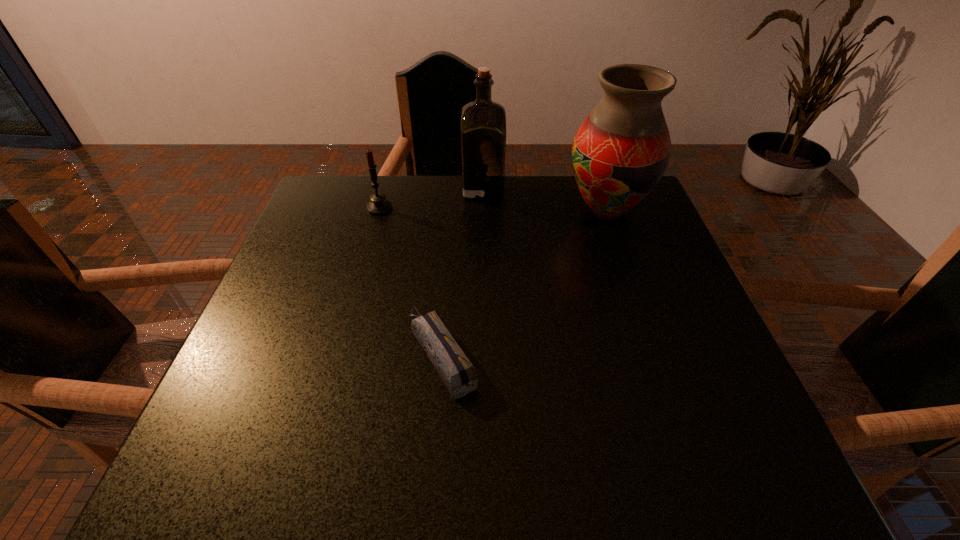
Identify the location of vase. The height and width of the screenshot is (540, 960). (620, 152).

Where is `liquor`? The image size is (960, 540). liquor is located at coordinates (483, 122).

Identify the location of candle. (379, 205).

Find the location of a particular element. the third tallest object is located at coordinates point(379,205).

Image resolution: width=960 pixels, height=540 pixels. I want to click on the shortest object, so click(x=458, y=373).

The image size is (960, 540). Find the location of `pencil box`. pencil box is located at coordinates (458, 373).

I want to click on free region located 0.140m on the left of the vase, so click(x=511, y=211).

This screenshot has width=960, height=540. What are the coordinates of `vacant space located on the label of the liquor` in the screenshot? It's located at pos(411,187).

The height and width of the screenshot is (540, 960). Identify the location of blank space located on the label of the liquor. (386, 187).

Locate an element on the screen. The height and width of the screenshot is (540, 960). vacant area situated 0.060m on the label of the liquor is located at coordinates (443, 187).